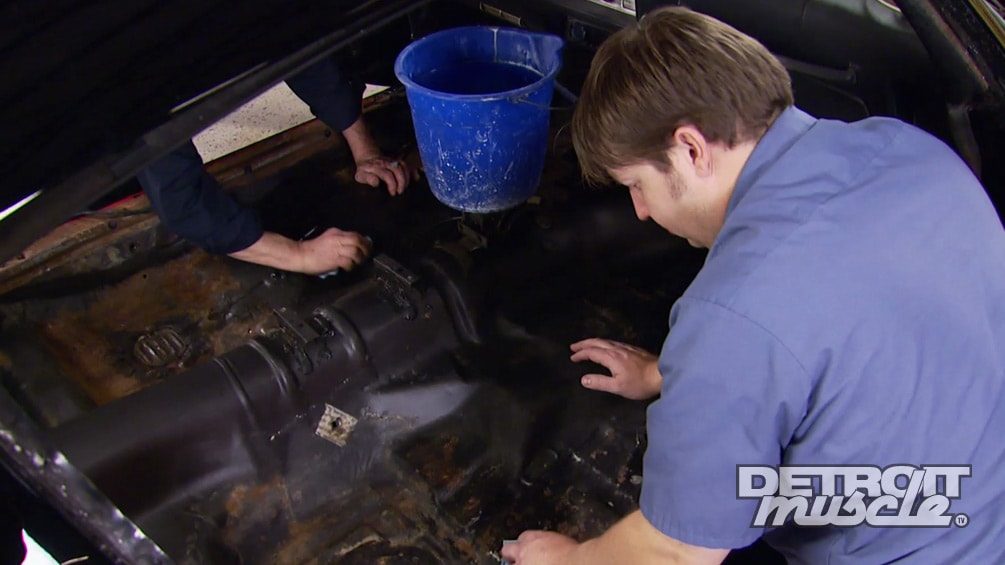
Locate an element on the screen. This screenshot has width=1005, height=565. sticker is located at coordinates (335, 440).